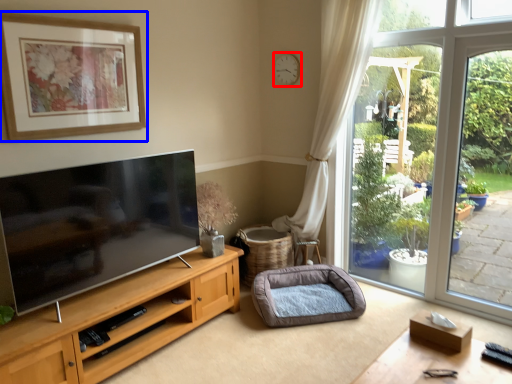
Question: Which object is further to the camera taking this photo, clock (highlighted by a red box) or picture frame (highlighted by a blue box)?

Choices:
 (A) clock
 (B) picture frame

Answer: (A)